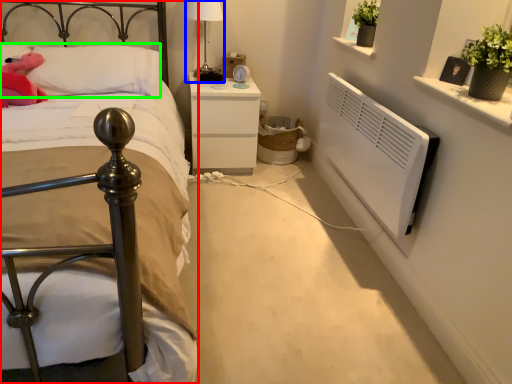
Question: Considering the real-world distances, which object is closest to bed (highlighted by a red box)? bedside lamp (highlighted by a blue box) or pillow (highlighted by a green box).

Choices:
 (A) bedside lamp
 (B) pillow

Answer: (B)